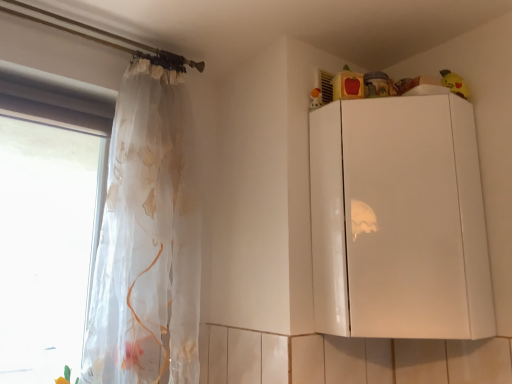
Find the location of `translucent floral fabric at left`. translucent floral fabric at left is located at coordinates (148, 239).

Identify the location of transparent fabric at left. This screenshot has width=512, height=384. (47, 233).

Describe the element at coordinates (47, 233) in the screenshot. The width and height of the screenshot is (512, 384). I see `transparent fabric at left` at that location.

Locate an element on the screen. yellow plush toy at upper right, which appears as the 1th toy when viewed from the right is located at coordinates (454, 83).

Measure the distance between yellow plush toy at upper right, positioned as the 2th toy in left-to-right order, and camera.

They are 1.45 meters apart.

This screenshot has height=384, width=512. Find the location of `translucent floral fabric at left`. translucent floral fabric at left is located at coordinates (148, 239).

In order to click on the 2nd toy positioned above the transparent fabric at left (from a real-world perspective) in this screenshot , I will do `click(454, 83)`.

From a real-world perspective, is transparent fabric at left on yellow plush toy at upper right, positioned as the 2th toy in left-to-right order?

No, from a real-world perspective, transparent fabric at left is not on top of yellow plush toy at upper right, positioned as the 2th toy in left-to-right order.

Is transparent fabric at left next to yellow plush toy at upper right, which appears as the 1th toy when viewed from the right, and touching it?

No, transparent fabric at left is not making contact with yellow plush toy at upper right, which appears as the 1th toy when viewed from the right.

How distant is transparent fabric at left from yellow plush toy at upper right, which appears as the 1th toy when viewed from the right?

They are 2.66 meters apart.

Looking at their sizes, would you say matte orange toy at upper right, the second toy viewed from the right, is wider or thinner than translucent floral fabric at left?

In the image, matte orange toy at upper right, the second toy viewed from the right, appears to be more narrow than translucent floral fabric at left.

From the image's perspective, does matte orange toy at upper right, which appears as the first toy when viewed from the left, appear lower than translucent floral fabric at left?

Actually, matte orange toy at upper right, which appears as the first toy when viewed from the left, appears above translucent floral fabric at left in the image.

What's the angular difference between matte orange toy at upper right, the second toy viewed from the right, and translucent floral fabric at left's facing directions?

They differ by 28 degrees in their facing directions.

Is matte orange toy at upper right, which appears as the first toy when viewed from the left, touching translucent floral fabric at left?

No, matte orange toy at upper right, which appears as the first toy when viewed from the left, is not making contact with translucent floral fabric at left.

From a real-world perspective, is white glossy cabinet at upper right positioned above or below matte orange toy at upper right, the second toy viewed from the right?

Clearly, from a real-world perspective, white glossy cabinet at upper right is below matte orange toy at upper right, the second toy viewed from the right.

Is white glossy cabinet at upper right located outside matte orange toy at upper right, which appears as the first toy when viewed from the left?

Yes.

Who is bigger, white glossy cabinet at upper right or matte orange toy at upper right, the second toy viewed from the right?

With larger size is white glossy cabinet at upper right.

The image size is (512, 384). I want to click on cabinetry on the left side of yellow plush toy at upper right, positioned as the 2th toy in left-to-right order, so click(x=398, y=220).

Considering the relative sizes of white glossy cabinet at upper right and yellow plush toy at upper right, which appears as the 1th toy when viewed from the right, in the image provided, is white glossy cabinet at upper right wider than yellow plush toy at upper right, which appears as the 1th toy when viewed from the right,?

Yes, white glossy cabinet at upper right is wider than yellow plush toy at upper right, which appears as the 1th toy when viewed from the right.

Consider the image. Is white glossy cabinet at upper right positioned with its back to yellow plush toy at upper right, positioned as the 2th toy in left-to-right order?

white glossy cabinet at upper right is not turned away from yellow plush toy at upper right, positioned as the 2th toy in left-to-right order.

From the image's perspective, who appears lower, white glossy cabinet at upper right or yellow plush toy at upper right, which appears as the 1th toy when viewed from the right?

white glossy cabinet at upper right is shown below in the image.

Who is smaller, translucent floral fabric at left or yellow plush toy at upper right, which appears as the 1th toy when viewed from the right?

yellow plush toy at upper right, which appears as the 1th toy when viewed from the right.

Is translucent floral fabric at left oriented away from yellow plush toy at upper right, which appears as the 1th toy when viewed from the right?

No.

Is translucent floral fabric at left to the left or to the right of yellow plush toy at upper right, which appears as the 1th toy when viewed from the right, in the image?

From the image, it's evident that translucent floral fabric at left is to the left of yellow plush toy at upper right, which appears as the 1th toy when viewed from the right.

Would you say white glossy cabinet at upper right is outside translucent floral fabric at left?

Indeed, white glossy cabinet at upper right is completely outside translucent floral fabric at left.

Is white glossy cabinet at upper right positioned in front of translucent floral fabric at left?

Yes, white glossy cabinet at upper right is closer to the viewer.

From a real-world perspective, relative to translucent floral fabric at left, is white glossy cabinet at upper right vertically above or below?

white glossy cabinet at upper right is situated higher than translucent floral fabric at left in the real world.

Is translucent floral fabric at left not within matte orange toy at upper right, the second toy viewed from the right?

translucent floral fabric at left is positioned outside matte orange toy at upper right, the second toy viewed from the right.

Is translucent floral fabric at left wider or thinner than matte orange toy at upper right, the second toy viewed from the right?

Clearly, translucent floral fabric at left has more width compared to matte orange toy at upper right, the second toy viewed from the right.

How different are the orientations of translucent floral fabric at left and matte orange toy at upper right, which appears as the first toy when viewed from the left, in degrees?

The angle between the facing direction of translucent floral fabric at left and the facing direction of matte orange toy at upper right, which appears as the first toy when viewed from the left, is 28 degrees.

Are translucent floral fabric at left and matte orange toy at upper right, the second toy viewed from the right, located far from each other?

No, there isn't a large distance between translucent floral fabric at left and matte orange toy at upper right, the second toy viewed from the right.

From the transparent fabric at left, count 1st toys backward and point to it. Please provide its 2D coordinates.

[(454, 83)]

There is a translucent floral fabric at left. At what (x,y) coordinates should I click in order to perform the action: click on the 1st toy above it (from the image's perspective). Please return your answer as a coordinate pair (x, y). The width and height of the screenshot is (512, 384). Looking at the image, I should click on (316, 98).

Which object lies nearer to the anchor point translucent floral fabric at left, matte orange toy at upper right, the second toy viewed from the right, or transparent fabric at left?

Among the two, matte orange toy at upper right, the second toy viewed from the right, is located nearer to translucent floral fabric at left.

Based on their spatial positions, is matte orange toy at upper right, the second toy viewed from the right, or yellow plush toy at upper right, which appears as the 1th toy when viewed from the right, closer to white glossy cabinet at upper right?

matte orange toy at upper right, the second toy viewed from the right, lies closer to white glossy cabinet at upper right than the other object.

Based on their spatial positions, is yellow plush toy at upper right, positioned as the 2th toy in left-to-right order, or white glossy cabinet at upper right closer to translucent floral fabric at left?

The object closer to translucent floral fabric at left is white glossy cabinet at upper right.

Which object lies nearer to the anchor point translucent floral fabric at left, white glossy cabinet at upper right or yellow plush toy at upper right, which appears as the 1th toy when viewed from the right?

Based on the image, white glossy cabinet at upper right appears to be nearer to translucent floral fabric at left.

When comparing their distances from translucent floral fabric at left, does matte orange toy at upper right, the second toy viewed from the right, or yellow plush toy at upper right, which appears as the 1th toy when viewed from the right, seem closer?

Among the two, matte orange toy at upper right, the second toy viewed from the right, is located nearer to translucent floral fabric at left.

From the image, which object appears to be nearer to matte orange toy at upper right, the second toy viewed from the right, translucent floral fabric at left or white glossy cabinet at upper right?

white glossy cabinet at upper right is positioned closer to the anchor matte orange toy at upper right, the second toy viewed from the right.

Looking at the image, which one is located closer to white glossy cabinet at upper right, yellow plush toy at upper right, positioned as the 2th toy in left-to-right order, or matte orange toy at upper right, which appears as the first toy when viewed from the left?

matte orange toy at upper right, which appears as the first toy when viewed from the left, is closer to white glossy cabinet at upper right.

Based on their spatial positions, is white glossy cabinet at upper right or yellow plush toy at upper right, which appears as the 1th toy when viewed from the right, closer to transparent fabric at left?

white glossy cabinet at upper right is closer to transparent fabric at left.

This screenshot has height=384, width=512. I want to click on toy between translucent floral fabric at left and yellow plush toy at upper right, which appears as the 1th toy when viewed from the right, so click(x=316, y=98).

At what (x,y) coordinates should I click in order to perform the action: click on toy between translucent floral fabric at left and white glossy cabinet at upper right. Please return your answer as a coordinate pair (x, y). Looking at the image, I should click on (316, 98).

You are a GUI agent. You are given a task and a screenshot of the screen. Output one action in this format:
    pyautogui.click(x=<x>, y=<y>)
    Task: Click on the cabinetry between transparent fabric at left and yellow plush toy at upper right, positioned as the 2th toy in left-to-right order
    This screenshot has width=512, height=384.
    Given the screenshot: What is the action you would take?
    pyautogui.click(x=398, y=220)

Locate an element on the screen. This screenshot has width=512, height=384. toy between transparent fabric at left and white glossy cabinet at upper right from left to right is located at coordinates 316,98.